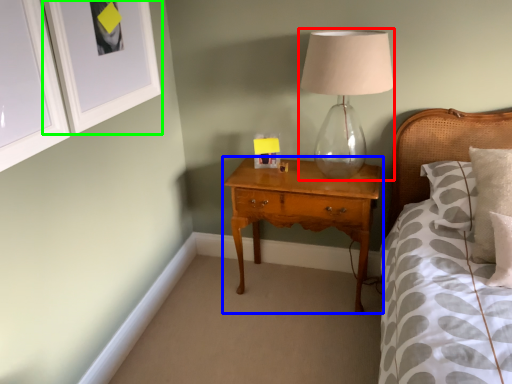
Question: Which object is positioned farthest from table lamp (highlighted by a red box)? Select from nightstand (highlighted by a blue box) and picture frame (highlighted by a green box).

Choices:
 (A) nightstand
 (B) picture frame

Answer: (B)